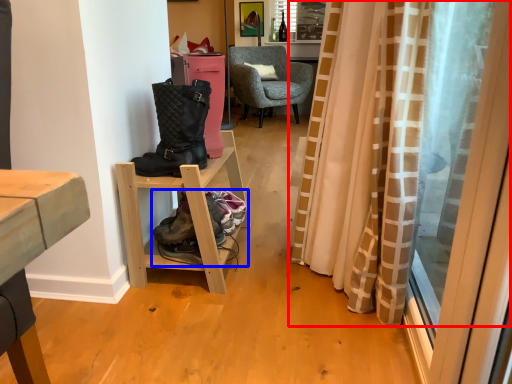
Question: Which of the following is the closest to the observer, curtain (highlighted by a red box) or footwear (highlighted by a blue box)?

Choices:
 (A) curtain
 (B) footwear

Answer: (A)